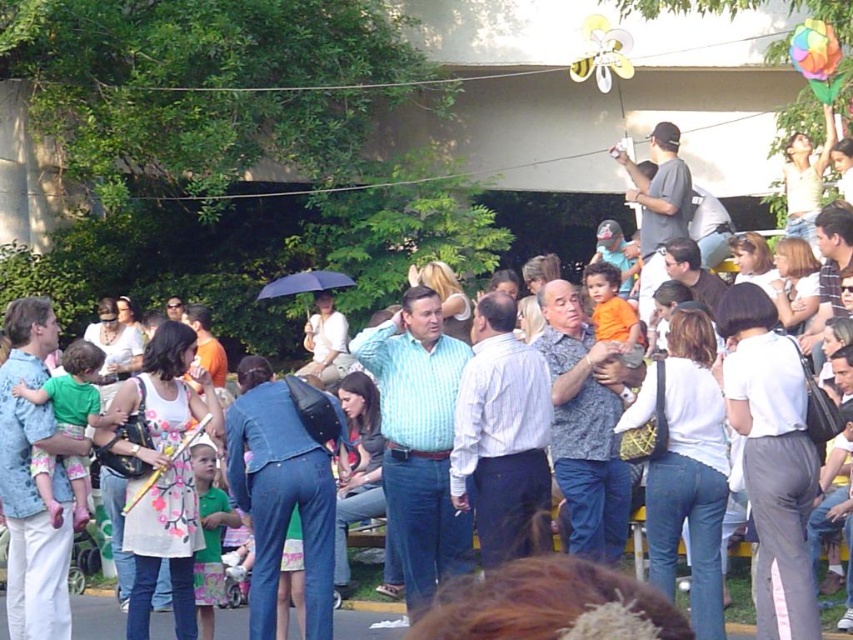
You are a photographer standing at the center of the gathering. You want to capture a photo that includes both the rainbow fabric balloon at upper right and the black matte umbrella at center. Is there enough space between them to fit both in the same frame without moving your position?

The rainbow fabric balloon at upper right and black matte umbrella at center are 6.90 meters apart from each other. Since the distance between them is significant, you can likely capture both in the same frame without needing to move your position, provided your camera has a wide enough lens to accommodate the 6.90 meters span.

You are a photographer trying to capture a clear photo of the black matte umbrella at center without the rainbow fabric balloon at upper right blocking it. What should you do?

The rainbow fabric balloon at upper right is in front of the black matte umbrella at center. To avoid the balloon blocking the umbrella, move your position to the left or right so that the balloon moves out of the frame or behind the umbrella.